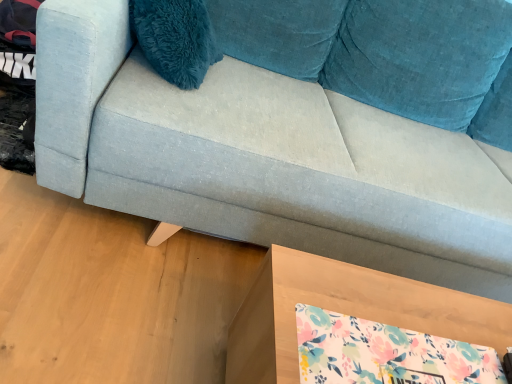
Question: From the image's perspective, relative to wooden table at lower right, is light blue fabric couch at center above or below?

Choices:
 (A) below
 (B) above

Answer: (B)

Question: Do you think light blue fabric couch at center is within wooden table at lower right, or outside of it?

Choices:
 (A) outside
 (B) inside

Answer: (A)

Question: In the image, is light blue fabric couch at center positioned in front of or behind wooden table at lower right?

Choices:
 (A) behind
 (B) front

Answer: (B)

Question: In terms of width, does wooden table at lower right look wider or thinner when compared to light blue fabric couch at center?

Choices:
 (A) wide
 (B) thin

Answer: (B)

Question: From the image's perspective, is wooden table at lower right located above or below light blue fabric couch at center?

Choices:
 (A) above
 (B) below

Answer: (B)

Question: Is wooden table at lower right bigger or smaller than light blue fabric couch at center?

Choices:
 (A) big
 (B) small

Answer: (B)

Question: Relative to light blue fabric couch at center, is wooden table at lower right in front or behind?

Choices:
 (A) front
 (B) behind

Answer: (B)